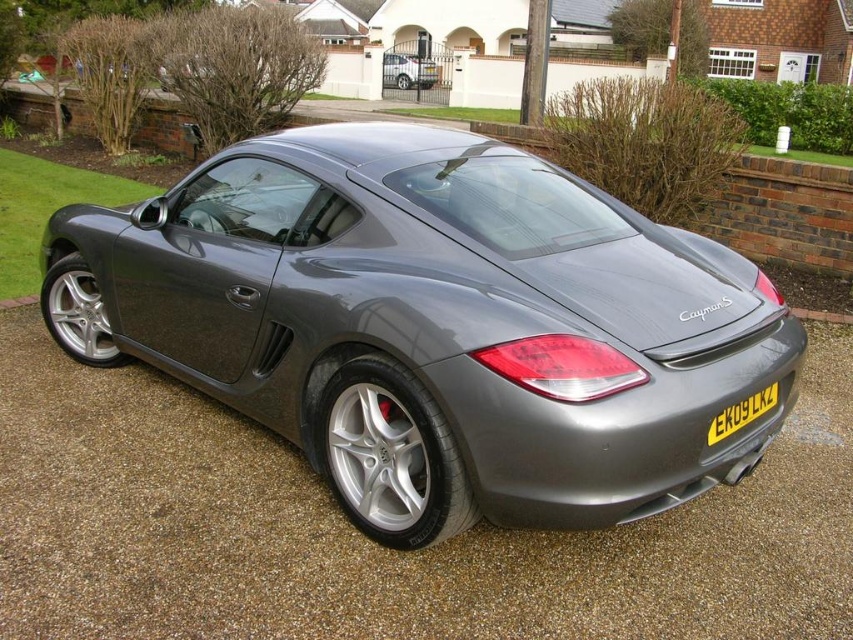
You are standing in front of the Porsche Cayman S and want to take a photo. You notice two points on the car labeled as point (772, 400) and point (427, 60). Which point will appear larger in your camera view?

Point (772, 400) is closer to the camera than point (427, 60), so it will appear larger in the camera view.